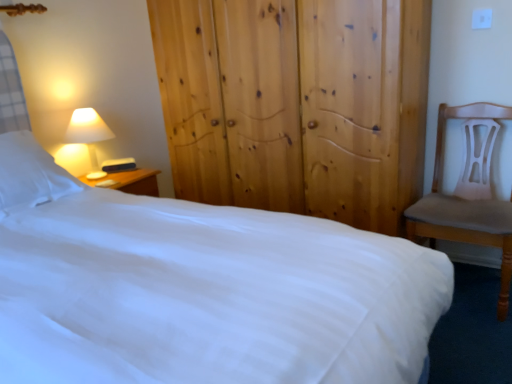
Question: Is matte white lampshade at left bigger or smaller than light brown wooden chair at right?

Choices:
 (A) small
 (B) big

Answer: (A)

Question: Visually, is matte white lampshade at left positioned to the left or to the right of light brown wooden chair at right?

Choices:
 (A) right
 (B) left

Answer: (B)

Question: Which object is positioned farthest from the matte white lampshade at left?

Choices:
 (A) light brown wooden chair at right
 (B) natural wood wardrobe at center
 (C) white smooth bed at center
 (D) white soft pillow at left

Answer: (A)

Question: Based on their relative distances, which object is nearer to the white smooth bed at center?

Choices:
 (A) light brown wooden chair at right
 (B) natural wood wardrobe at center
 (C) matte white lampshade at left
 (D) white soft pillow at left

Answer: (D)